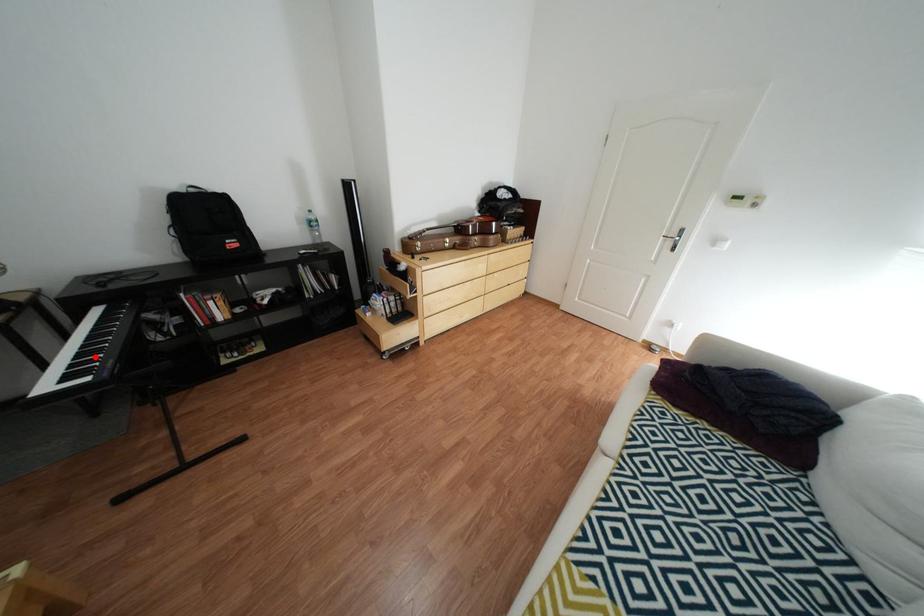
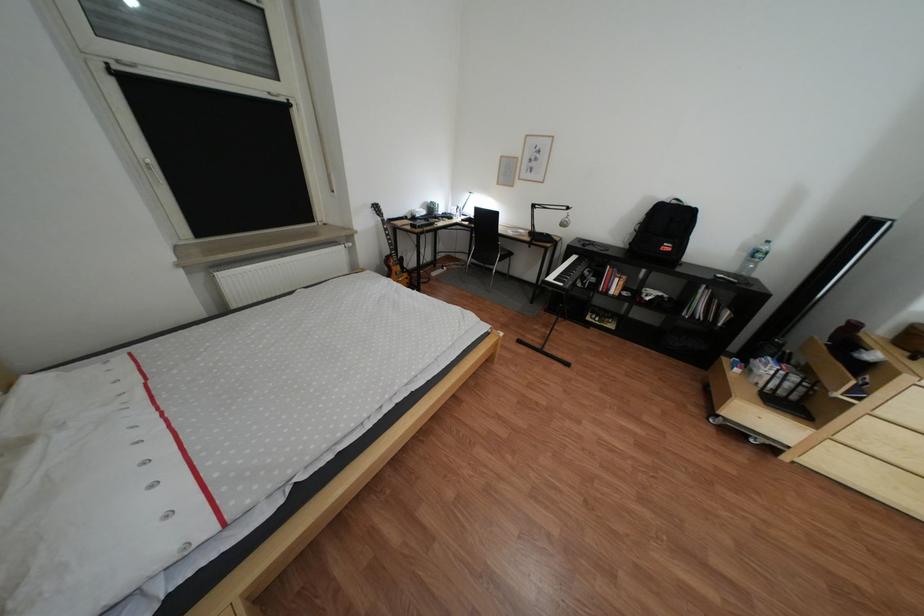
Find the pixel in the second image that matches the highlighted location in the first image.

(578, 274)